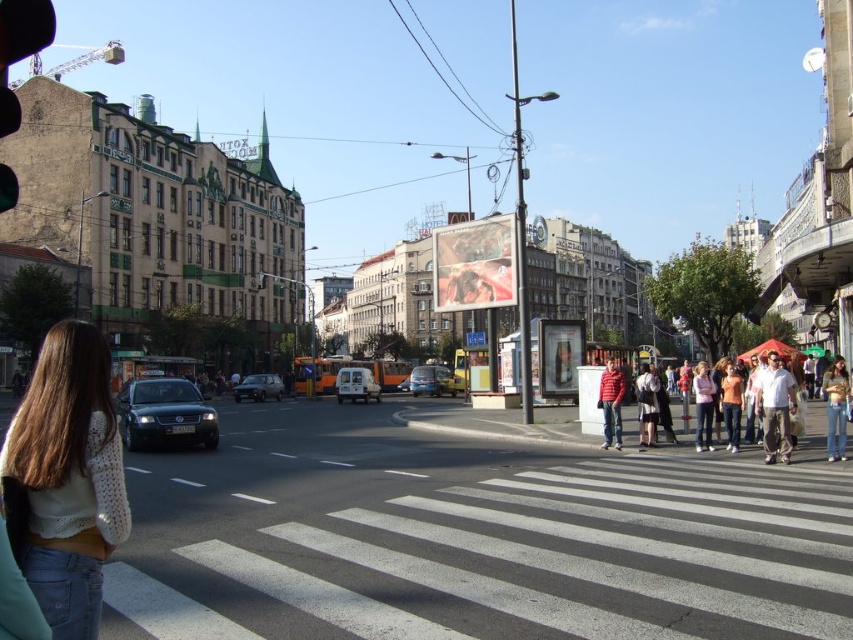
Question: Which point is closer to the camera taking this photo?

Choices:
 (A) (782, 410)
 (B) (807, 371)
 (C) (653, 392)
 (D) (613, 444)

Answer: (A)

Question: Does white cotton shirt at lower right have a larger size compared to jeans at crosswalk?

Choices:
 (A) yes
 (B) no

Answer: (B)

Question: Among these objects, which one is farthest from the camera?

Choices:
 (A) leather jacket at center
 (B) green glass traffic light at center
 (C) pink fabric jacket at lower right

Answer: (B)

Question: Does black glass traffic light at left appear on the left side of green glass traffic light at center?

Choices:
 (A) yes
 (B) no

Answer: (A)

Question: Can you confirm if white knitted sweater at lower left is positioned to the right of jeans at crosswalk?

Choices:
 (A) yes
 (B) no

Answer: (B)

Question: Considering the real-world distances, which object is farthest from the orange matte shirt at center?

Choices:
 (A) white cotton shirt at lower right
 (B) white knitted sweater at lower left

Answer: (B)